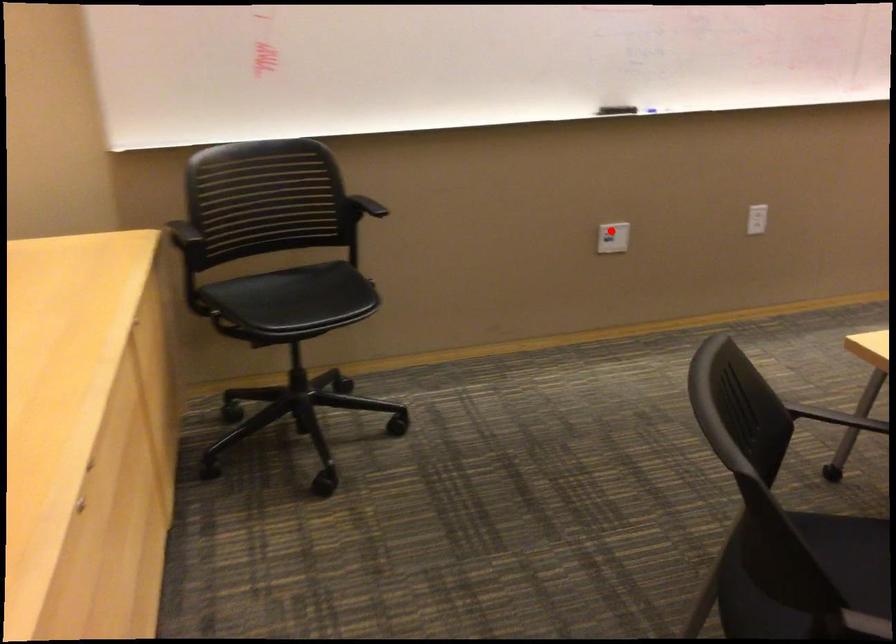
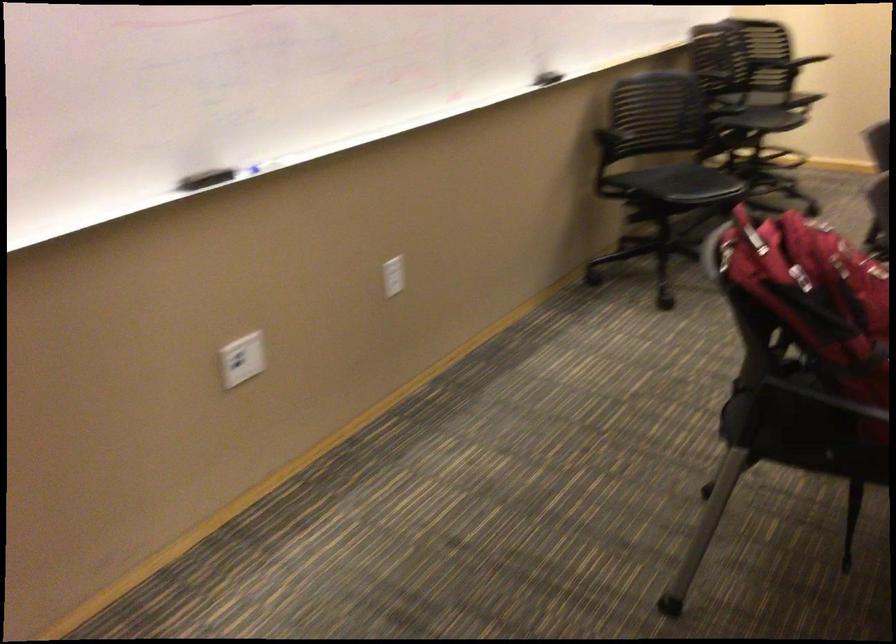
Where in the second image is the point corresponding to the highlighted location from the first image?

(242, 359)